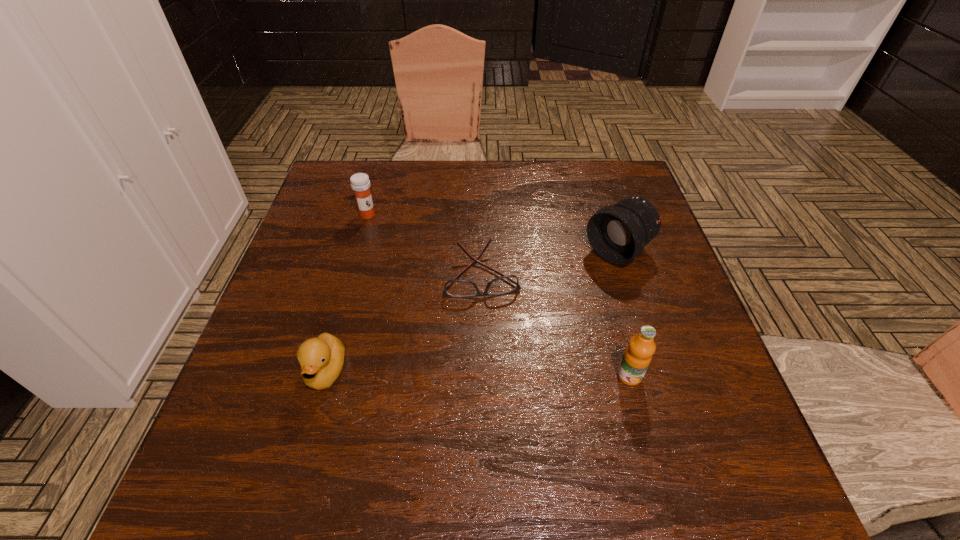
Where is `vacant space situated on the front-facing side of the spectacles`? vacant space situated on the front-facing side of the spectacles is located at coordinates (500, 395).

At what (x,y) coordinates should I click in order to perform the action: click on vacant space located on the front-facing side of the spectacles. Please return your answer as a coordinate pair (x, y). This screenshot has height=540, width=960. Looking at the image, I should click on (500, 395).

I want to click on free space located on the front-facing side of the spectacles, so click(x=491, y=330).

I want to click on free space located 0.400m at the front element of the telephoto lens, so click(470, 364).

Find the location of `vacant point located at the front element of the telephoto lens`. vacant point located at the front element of the telephoto lens is located at coordinates (496, 344).

At what (x,y) coordinates should I click in order to perform the action: click on vacant region located at the front element of the telephoto lens. Please return your answer as a coordinate pair (x, y). Looking at the image, I should click on (489, 349).

The image size is (960, 540). I want to click on object that is at the near edge, so click(321, 359).

I want to click on duckling at the left edge, so click(321, 359).

This screenshot has width=960, height=540. What are the coordinates of `medicine located in the left edge section of the desktop` in the screenshot? It's located at (360, 183).

Image resolution: width=960 pixels, height=540 pixels. Find the location of `orange juice that is positioned at the right edge`. orange juice that is positioned at the right edge is located at coordinates (637, 356).